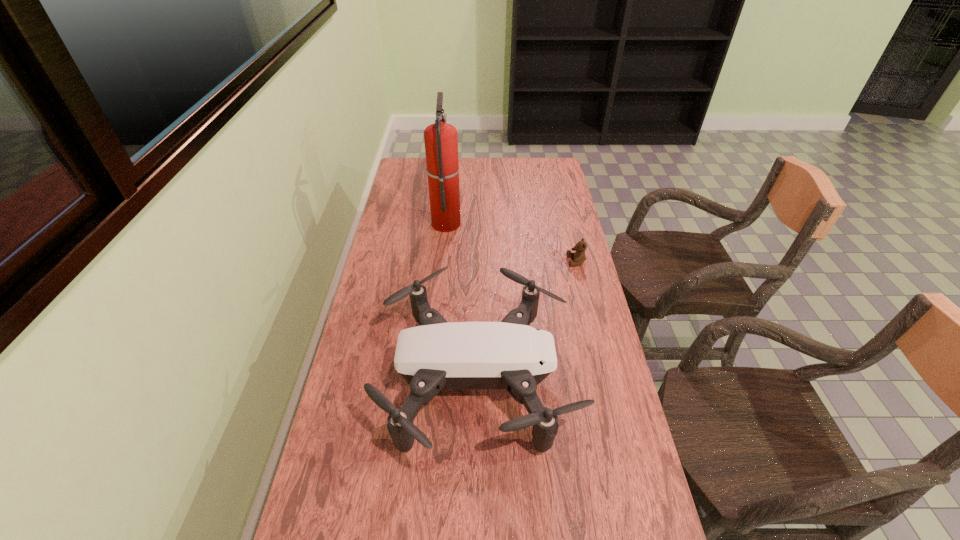
The height and width of the screenshot is (540, 960). I want to click on empty space between the fire extinguisher and the rightmost object, so [x=512, y=242].

Where is `free spot between the fire extinguisher and the second nearest object`? The image size is (960, 540). free spot between the fire extinguisher and the second nearest object is located at coordinates (512, 242).

I want to click on empty location between the fire extinguisher and the second shortest object, so point(462,301).

Where is `vacant area that lies between the second tallest object and the fire extinguisher`? The width and height of the screenshot is (960, 540). vacant area that lies between the second tallest object and the fire extinguisher is located at coordinates (462, 301).

Locate an element on the screen. vacant area that lies between the rightmost object and the fire extinguisher is located at coordinates (512, 242).

Locate an element on the screen. free space between the nearest object and the fire extinguisher is located at coordinates (462, 301).

Choose which object is the nearest neighbor to the second nearest object. Please provide its 2D coordinates. Your answer should be formatted as a tuple, i.e. [(x, y)], where the tuple contains the x and y coordinates of a point satisfying the conditions above.

[(511, 355)]

Point out which object is positioned as the nearest to the nearest object. Please provide its 2D coordinates. Your answer should be formatted as a tuple, i.e. [(x, y)], where the tuple contains the x and y coordinates of a point satisfying the conditions above.

[(579, 257)]